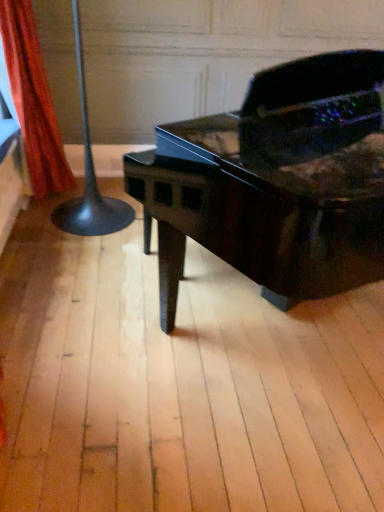
Question: Is orange fabric curtain at left facing towards glossy black piano at center?

Choices:
 (A) yes
 (B) no

Answer: (B)

Question: Is orange fabric curtain at left at the left side of glossy black piano at center?

Choices:
 (A) no
 (B) yes

Answer: (B)

Question: From the image's perspective, would you say orange fabric curtain at left is positioned over glossy black piano at center?

Choices:
 (A) yes
 (B) no

Answer: (A)

Question: Is orange fabric curtain at left further to the viewer compared to glossy black piano at center?

Choices:
 (A) yes
 (B) no

Answer: (A)

Question: Does orange fabric curtain at left have a greater height compared to glossy black piano at center?

Choices:
 (A) no
 (B) yes

Answer: (A)

Question: Considering the relative positions of orange fabric curtain at left and glossy black piano at center in the image provided, is orange fabric curtain at left to the right of glossy black piano at center from the viewer's perspective?

Choices:
 (A) no
 (B) yes

Answer: (A)

Question: Does glossy black piano at center come behind orange fabric curtain at left?

Choices:
 (A) no
 (B) yes

Answer: (A)

Question: Does glossy black piano at center appear on the right side of orange fabric curtain at left?

Choices:
 (A) no
 (B) yes

Answer: (B)

Question: Is glossy black piano at center looking in the opposite direction of orange fabric curtain at left?

Choices:
 (A) no
 (B) yes

Answer: (B)

Question: Is glossy black piano at center smaller than orange fabric curtain at left?

Choices:
 (A) yes
 (B) no

Answer: (B)

Question: Is glossy black piano at center far from orange fabric curtain at left?

Choices:
 (A) no
 (B) yes

Answer: (B)

Question: Is glossy black piano at center thinner than orange fabric curtain at left?

Choices:
 (A) yes
 (B) no

Answer: (B)

Question: Visually, is orange fabric curtain at left positioned to the left or to the right of glossy black piano at center?

Choices:
 (A) left
 (B) right

Answer: (A)